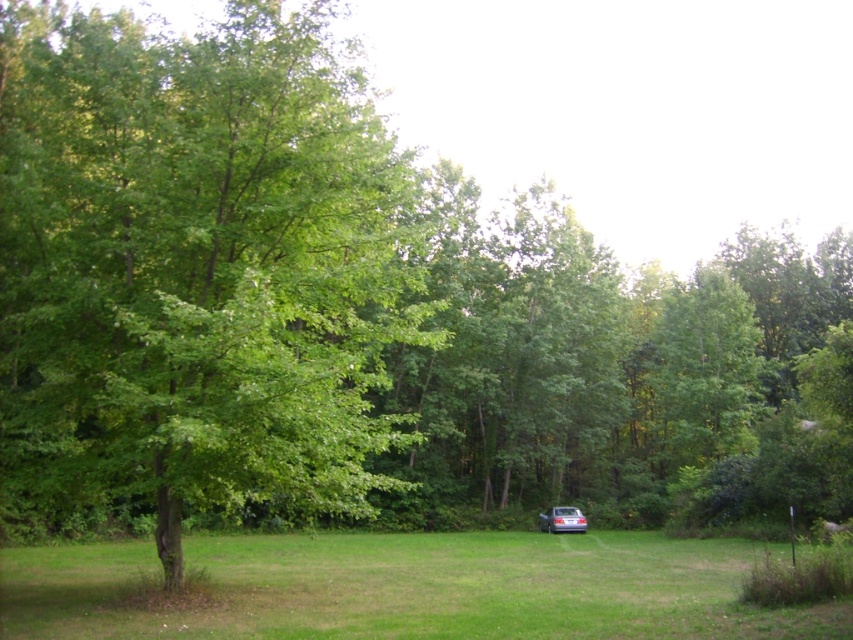
Does green leafy tree at center appear on the left side of satin silver sedan at center?

Indeed, green leafy tree at center is positioned on the left side of satin silver sedan at center.

Does green leafy tree at center appear on the right side of satin silver sedan at center?

In fact, green leafy tree at center is to the left of satin silver sedan at center.

Is point (13, 13) farther from viewer compared to point (576, 522)?

No, (13, 13) is closer to viewer.

The image size is (853, 640). In order to click on green leafy tree at center in this screenshot , I will do 198,266.